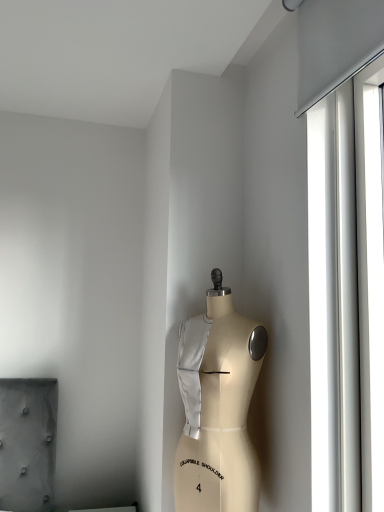
Question: Should I look upward or downward to see transparent glass shop window at right?

Choices:
 (A) up
 (B) down

Answer: (B)